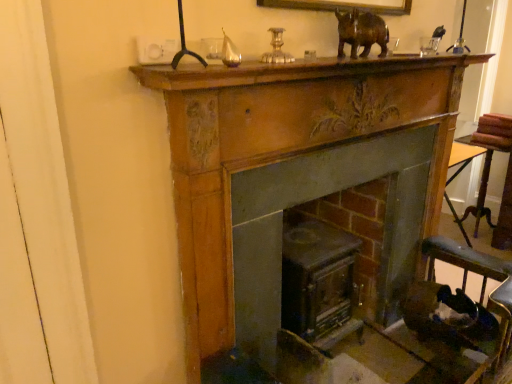
Question: Can you confirm if smooth dark wood fireplace at center, placed as the 1th fireplace when sorted from left to right, is positioned to the right of wooden mantle at upper center?

Choices:
 (A) no
 (B) yes

Answer: (A)

Question: Would you say smooth dark wood fireplace at center, placed as the 1th fireplace when sorted from left to right, is outside wooden mantle at upper center?

Choices:
 (A) no
 (B) yes

Answer: (B)

Question: Is smooth dark wood fireplace at center, placed as the second fireplace when sorted from right to left, closer to camera compared to wooden mantle at upper center?

Choices:
 (A) yes
 (B) no

Answer: (B)

Question: Is smooth dark wood fireplace at center, placed as the 1th fireplace when sorted from left to right, bigger than wooden mantle at upper center?

Choices:
 (A) no
 (B) yes

Answer: (B)

Question: Is smooth dark wood fireplace at center, placed as the second fireplace when sorted from right to left, looking in the opposite direction of wooden mantle at upper center?

Choices:
 (A) yes
 (B) no

Answer: (B)

Question: Can you confirm if wooden mantle at upper center is thinner than smooth dark wood fireplace at center, placed as the second fireplace when sorted from right to left?

Choices:
 (A) no
 (B) yes

Answer: (B)

Question: From a real-world perspective, is wooden mantle at upper center on smooth dark wood fireplace at center, placed as the 1th fireplace when sorted from left to right?

Choices:
 (A) yes
 (B) no

Answer: (A)

Question: Is wooden mantle at upper center wider than smooth dark wood fireplace at center, placed as the 1th fireplace when sorted from left to right?

Choices:
 (A) no
 (B) yes

Answer: (A)

Question: Is the depth of wooden mantle at upper center greater than that of smooth dark wood fireplace at center, placed as the second fireplace when sorted from right to left?

Choices:
 (A) yes
 (B) no

Answer: (B)

Question: Considering the relative positions of wooden mantle at upper center and smooth dark wood fireplace at center, placed as the 1th fireplace when sorted from left to right, in the image provided, is wooden mantle at upper center to the right of smooth dark wood fireplace at center, placed as the 1th fireplace when sorted from left to right, from the viewer's perspective?

Choices:
 (A) yes
 (B) no

Answer: (A)

Question: From the image's perspective, would you say wooden mantle at upper center is shown under smooth dark wood fireplace at center, placed as the 1th fireplace when sorted from left to right?

Choices:
 (A) no
 (B) yes

Answer: (A)

Question: From the image's perspective, is smooth dark wood fireplace at center, placed as the 1th fireplace when sorted from left to right, under brown polished wood rhino at upper center?

Choices:
 (A) yes
 (B) no

Answer: (A)